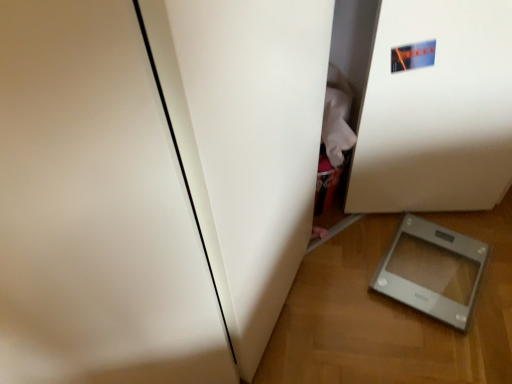
Where is `vacant region below silver plastic scale at lower right (from a real-world perspective)`? This screenshot has width=512, height=384. vacant region below silver plastic scale at lower right (from a real-world perspective) is located at coordinates (431, 268).